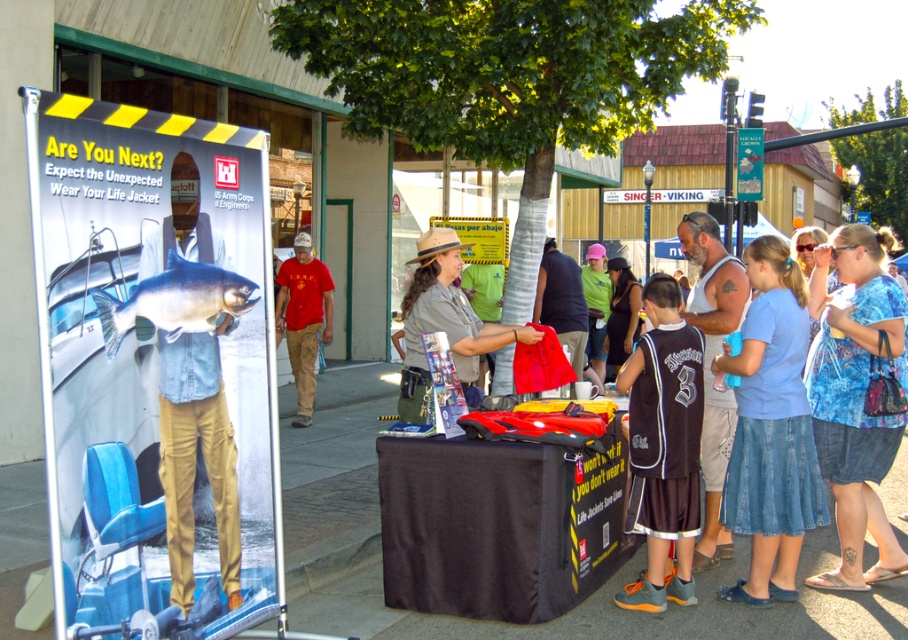
You are standing at the fair and want to take a photo of both the banner and the tree. The banner is at point (381, 472) and the tree is at point (188, 323). Which point should you focus on first to ensure both are in focus?

You should focus on point (188, 323) first because it is closer to you than point (381, 472), which is further away. This way, both points will be within the camera focus range.